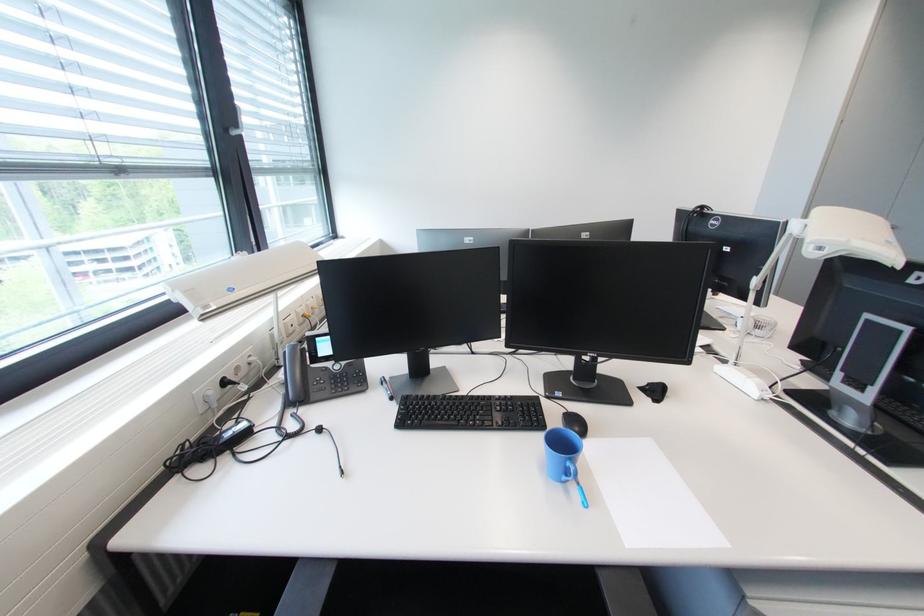
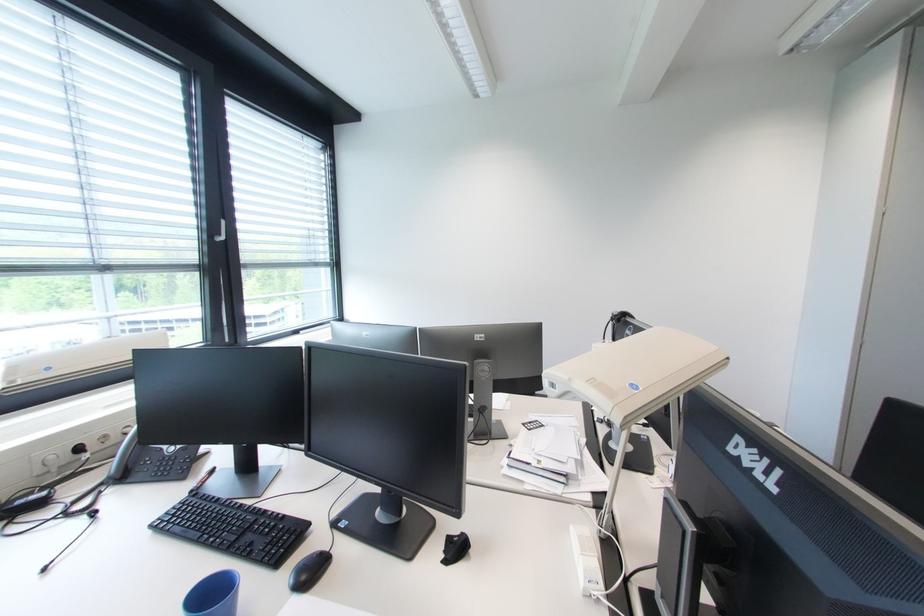
The point at (517, 398) is marked in the first image. Where is the corresponding point in the second image?

(290, 517)